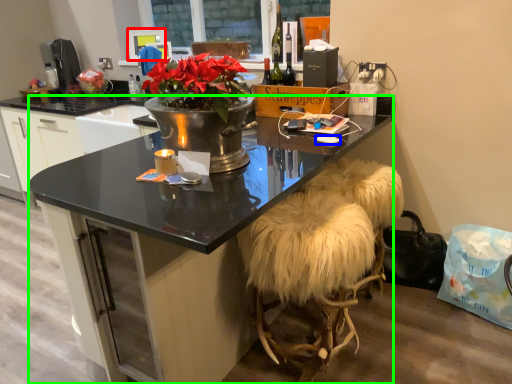
Question: Estimate the real-world distances between objects in this image. Which object is closer to television (highlighted by a red box), mobile phone (highlighted by a blue box) or desk (highlighted by a green box)?

Choices:
 (A) mobile phone
 (B) desk

Answer: (B)